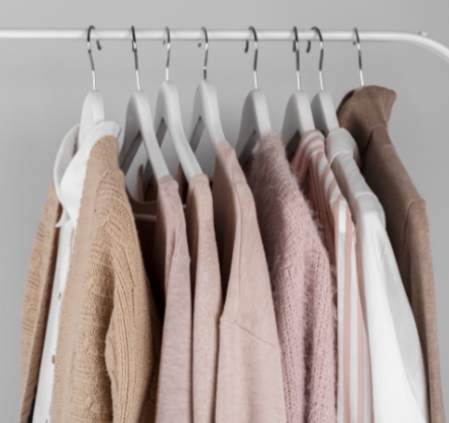
You are a GUI agent. You are given a task and a screenshot of the screen. Output one action in this format:
    pyautogui.click(x=<x>, y=<y>)
    Task: Click on the hanger
    This screenshot has width=449, height=423.
    Given the screenshot: What is the action you would take?
    pyautogui.click(x=95, y=52), pyautogui.click(x=132, y=45), pyautogui.click(x=166, y=49), pyautogui.click(x=204, y=43), pyautogui.click(x=257, y=41), pyautogui.click(x=293, y=38), pyautogui.click(x=319, y=38), pyautogui.click(x=358, y=38)